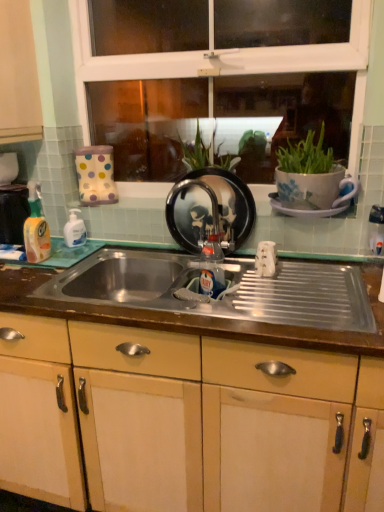
Question: From a real-world perspective, is yellow translucent liquid at left, placed as the first bottle when sorted from left to right, positioned above or below white glossy bottle at left, the 2th bottle in the right-to-left sequence?

Choices:
 (A) above
 (B) below

Answer: (A)

Question: Considering the positions of yellow translucent liquid at left, placed as the first bottle when sorted from left to right, and white glossy bottle at left, the 2th bottle in the right-to-left sequence, in the image, is yellow translucent liquid at left, placed as the first bottle when sorted from left to right, taller or shorter than white glossy bottle at left, the 2th bottle in the right-to-left sequence,?

Choices:
 (A) tall
 (B) short

Answer: (A)

Question: Which object is the farthest from the matte wood cabinet at left, the first cabinetry viewed from the top?

Choices:
 (A) metallic stainless steel sink at center
 (B) white glossy bottle at left, the 2th bottle in the right-to-left sequence
 (C) translucent plastic bottle at center, arranged as the 1th bottle when viewed from the right
 (D) black glossy frying pan at center
 (E) matte wood cabinetry at center, the 1th cabinetry from the bottom

Answer: (E)

Question: Estimate the real-world distances between objects in this image. Which object is closer to the white glossy bottle at left, the 2th bottle viewed from the left?

Choices:
 (A) matte wood cabinet at left, the first cabinetry when ordered from left to right
 (B) black glossy frying pan at center
 (C) metallic stainless steel sink at center
 (D) translucent plastic bottle at center, positioned as the third bottle in left-to-right order
 (E) yellow translucent liquid at left, the third bottle positioned from the right

Answer: (E)